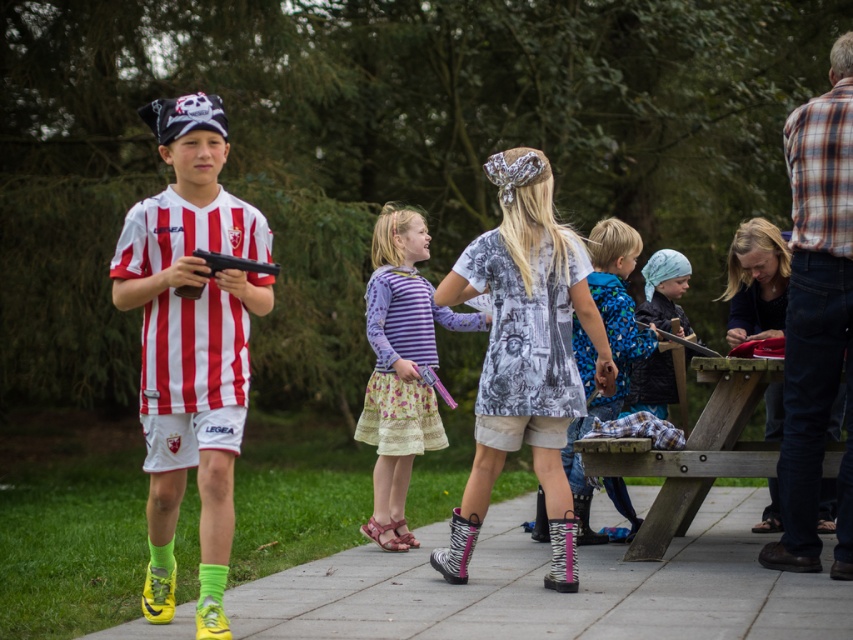
Question: Estimate the real-world distances between objects in this image. Which object is farther from the matte black gun at center?

Choices:
 (A) wooden picnic table at lower right
 (B) striped fabric dress at center
 (C) printed fabric dress at center

Answer: (A)

Question: Does wooden picnic table at lower right have a greater width compared to printed fabric dress at center?

Choices:
 (A) no
 (B) yes

Answer: (B)

Question: Which of the following is the closest to the observer?

Choices:
 (A) (218, 467)
 (B) (366, 328)
 (C) (579, 465)
 (D) (540, 442)

Answer: (A)

Question: Can you confirm if concrete pavement at center is positioned to the left of wooden picnic table at lower right?

Choices:
 (A) yes
 (B) no

Answer: (A)

Question: Estimate the real-world distances between objects in this image. Which object is farther from the printed fabric shirt at center?

Choices:
 (A) matte red and white jersey at center
 (B) wooden picnic table at lower right

Answer: (A)

Question: Can you confirm if striped fabric dress at center is bigger than matte black gun at center?

Choices:
 (A) yes
 (B) no

Answer: (A)